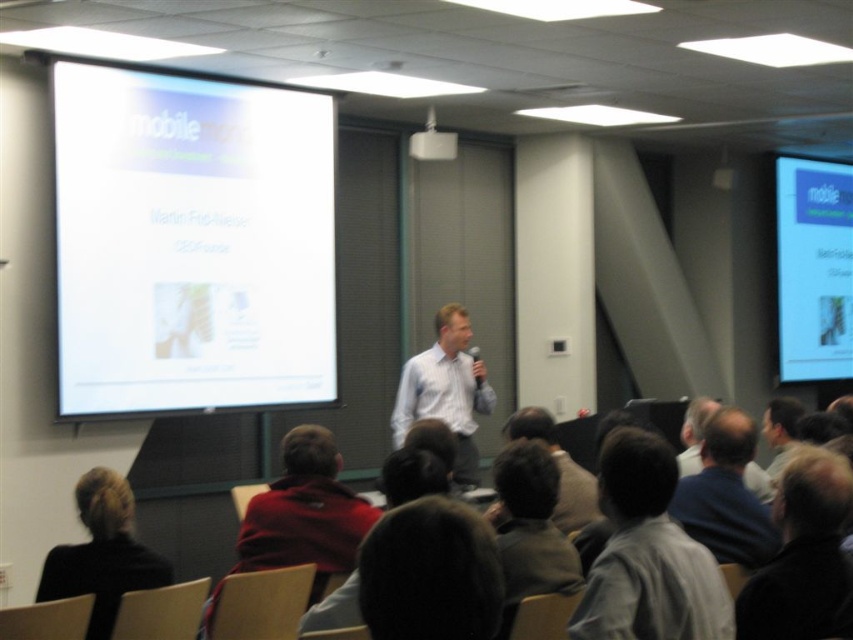
Does white glossy projector screen at upper left have a greater height compared to matte white projector screen at upper right?

No, white glossy projector screen at upper left is not taller than matte white projector screen at upper right.

Locate an element on the screen. white glossy projector screen at upper left is located at coordinates (190, 243).

Can you confirm if dark gray shirt at center is shorter than dark brown hair at center?

Incorrect, dark gray shirt at center's height does not fall short of dark brown hair at center's.

Who is taller, dark gray shirt at center or dark brown hair at center?

dark gray shirt at center

Identify the location of dark gray shirt at center. This screenshot has width=853, height=640. (531, 524).

From the picture: Is dark gray shirt at center bigger than light brown hair at lower right?

Incorrect, dark gray shirt at center is not larger than light brown hair at lower right.

This screenshot has width=853, height=640. I want to click on dark gray shirt at center, so click(x=531, y=524).

The width and height of the screenshot is (853, 640). I want to click on dark gray shirt at center, so click(531, 524).